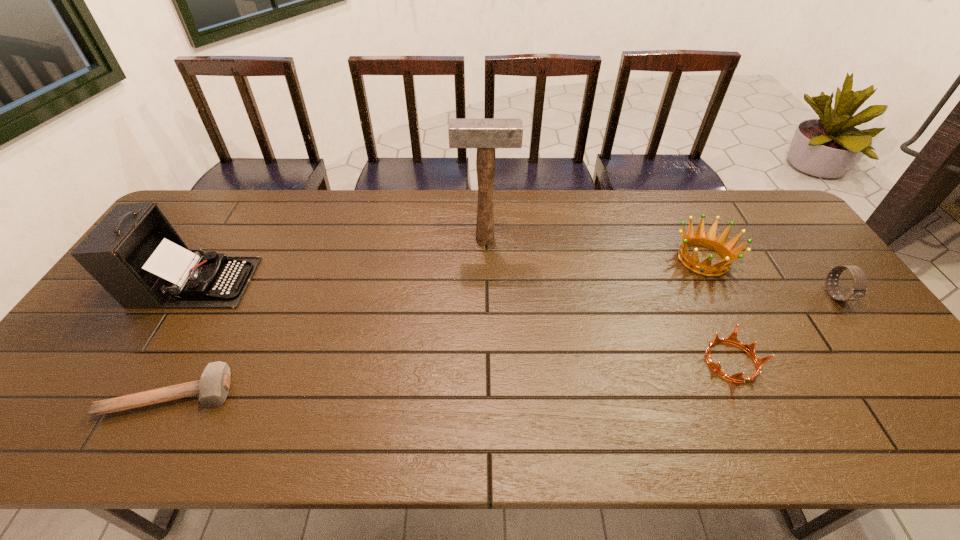
The height and width of the screenshot is (540, 960). I want to click on object that is at the near left corner, so click(213, 387).

The height and width of the screenshot is (540, 960). What are the coordinates of `free spot at the far edge of the desktop` in the screenshot? It's located at (619, 216).

In order to click on vacant space at the near edge of the desktop in this screenshot , I will do `click(498, 449)`.

Where is `vacant space that's between the shorter crown and the typewriter`? This screenshot has width=960, height=540. vacant space that's between the shorter crown and the typewriter is located at coordinates (463, 322).

Where is `vacant point located between the shorter mallet and the second tallest object`? vacant point located between the shorter mallet and the second tallest object is located at coordinates (182, 339).

This screenshot has width=960, height=540. What are the coordinates of `free space between the fifth shortest object and the farther crown` in the screenshot? It's located at (449, 271).

The height and width of the screenshot is (540, 960). Find the location of `empty space that is in between the left mallet and the second tallest object`. empty space that is in between the left mallet and the second tallest object is located at coordinates (182, 339).

Locate an element on the screen. This screenshot has width=960, height=540. empty space that is in between the taller mallet and the fifth tallest object is located at coordinates (608, 300).

The image size is (960, 540). I want to click on vacant area between the rightmost object and the taller crown, so click(x=770, y=278).

Locate an element on the screen. free space between the typewriter and the farther crown is located at coordinates (449, 271).